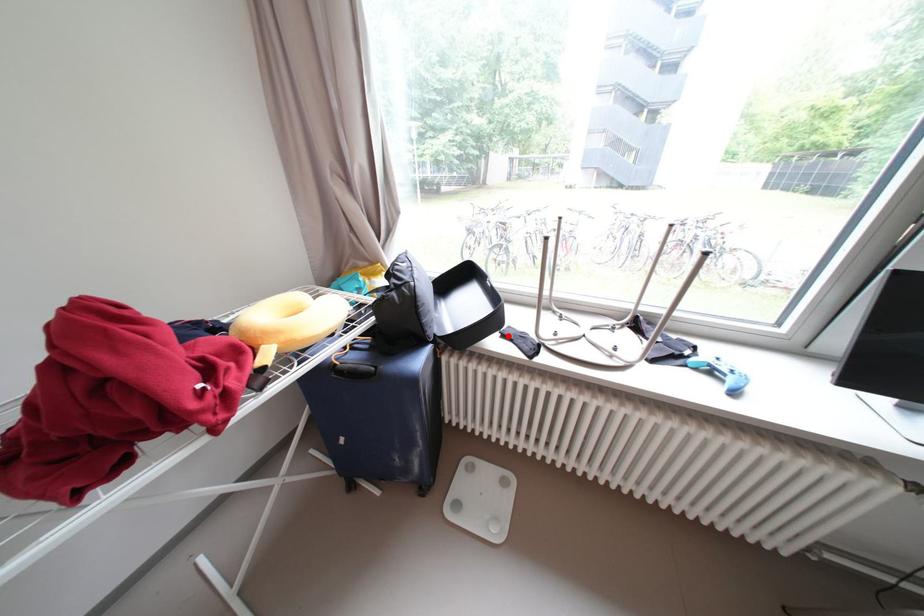
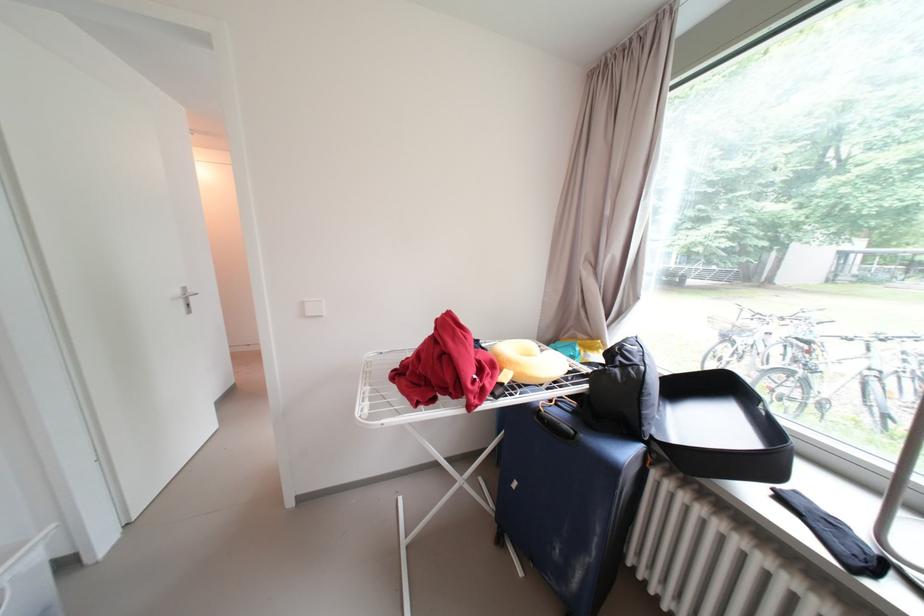
The point at the highlighted location is marked in the first image. Where is the corresponding point in the second image?

(781, 493)